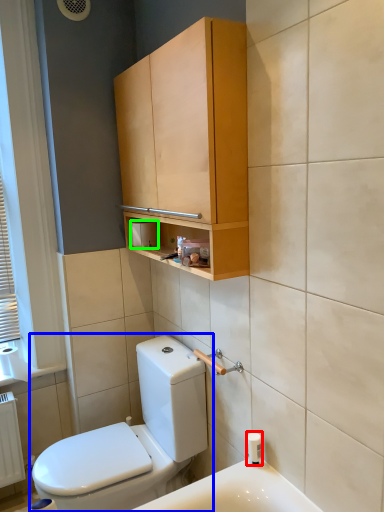
Question: Which is nearer to the toiletry (highlighted by a red box)? toilet (highlighted by a blue box) or toilet paper (highlighted by a green box).

Choices:
 (A) toilet
 (B) toilet paper

Answer: (A)